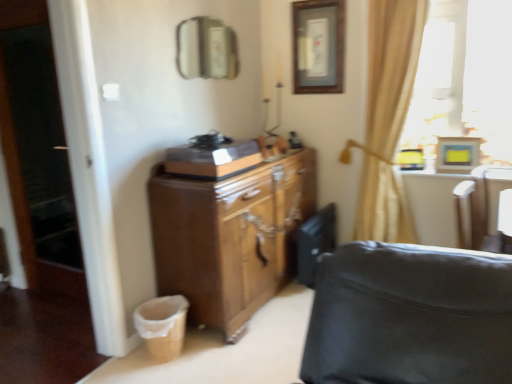
Locate an element on the screen. The width and height of the screenshot is (512, 384). beige fabric curtain at upper right is located at coordinates (388, 118).

What do you see at coordinates (40, 143) in the screenshot? I see `transparent glass screen door at left` at bounding box center [40, 143].

Locate an element on the screen. The image size is (512, 384). wooden picture frame at upper center, acting as the 1th picture frame starting from the left is located at coordinates (318, 46).

This screenshot has height=384, width=512. What do you see at coordinates (457, 154) in the screenshot? I see `wooden picture frame at upper right, which is counted as the second picture frame, starting from the left` at bounding box center [457, 154].

What is the approximate height of metallic rectangular mirror at upper center?

16.21 inches.

Locate an element on the screen. This screenshot has width=512, height=384. metallic rectangular mirror at upper center is located at coordinates (206, 49).

Image resolution: width=512 pixels, height=384 pixels. Identify the location of beige fabric curtain at upper right. (388, 118).

Is white leather swivel chair at right placed right next to beige fabric laundry basket at lower left?

No, white leather swivel chair at right is not next to beige fabric laundry basket at lower left.

Is white leather swivel chair at right further to the viewer compared to beige fabric laundry basket at lower left?

No, the depth of white leather swivel chair at right is less than that of beige fabric laundry basket at lower left.

Which is nearer, (x=472, y=181) or (x=175, y=336)?

Point (x=472, y=181) is farther from the camera than point (x=175, y=336).

From the image's perspective, which is above, wooden picture frame at upper right, the 1th picture frame when ordered from front to back, or wooden picture frame at upper center, marked as the 1th picture frame in a back-to-front arrangement?

wooden picture frame at upper center, marked as the 1th picture frame in a back-to-front arrangement, from the image's perspective.

Is wooden picture frame at upper right, which is counted as the second picture frame, starting from the left, positioned beyond the bounds of wooden picture frame at upper center, arranged as the 2th picture frame when viewed from the front?

Indeed, wooden picture frame at upper right, which is counted as the second picture frame, starting from the left, is completely outside wooden picture frame at upper center, arranged as the 2th picture frame when viewed from the front.

In the image, is wooden picture frame at upper right, the 2th picture frame in the top-to-bottom sequence, positioned in front of or behind wooden picture frame at upper center, acting as the second picture frame starting from the right?

Clearly, wooden picture frame at upper right, the 2th picture frame in the top-to-bottom sequence, is in front of wooden picture frame at upper center, acting as the second picture frame starting from the right.

Is wooden picture frame at upper right, the 1th picture frame when ordered from front to back, to the left of wooden picture frame at upper center, acting as the 1th picture frame starting from the left, from the viewer's perspective?

No, wooden picture frame at upper right, the 1th picture frame when ordered from front to back, is not to the left of wooden picture frame at upper center, acting as the 1th picture frame starting from the left.

Based on the photo, from the image's perspective, is wooden picture frame at upper right, the 1th picture frame from the bottom, positioned above or below wooden cabinet at center?

wooden picture frame at upper right, the 1th picture frame from the bottom, is situated higher than wooden cabinet at center in the image.

Who is taller, wooden picture frame at upper right, which is counted as the second picture frame, starting from the left, or wooden cabinet at center?

→ Standing taller between the two is wooden picture frame at upper right, which is counted as the second picture frame, starting from the left.

This screenshot has width=512, height=384. Identify the location of appliance that appears below the wooden picture frame at upper right, placed as the first picture frame when sorted from right to left (from the image's perspective). (213, 160).

Is wooden picture frame at upper right, placed as the first picture frame when sorted from right to left, outside of wooden cabinet at center?

wooden picture frame at upper right, placed as the first picture frame when sorted from right to left, lies outside wooden cabinet at center's area.

Is brown wood cabinet at center oriented towards beige fabric laundry basket at lower left?

No, brown wood cabinet at center does not turn towards beige fabric laundry basket at lower left.

Is brown wood cabinet at center in front of or behind beige fabric laundry basket at lower left in the image?

Clearly, brown wood cabinet at center is in front of beige fabric laundry basket at lower left.

Who is smaller, brown wood cabinet at center or beige fabric laundry basket at lower left?

beige fabric laundry basket at lower left.

From the image's perspective, is brown wood cabinet at center below beige fabric laundry basket at lower left?

No, from the image's perspective, brown wood cabinet at center is not beneath beige fabric laundry basket at lower left.

You are a GUI agent. You are given a task and a screenshot of the screen. Output one action in this format:
    pyautogui.click(x=<x>, y=<y>)
    Task: Click on the screen door located above the beige fabric laundry basket at lower left (from a real-world perspective)
    This screenshot has width=512, height=384.
    Given the screenshot: What is the action you would take?
    pyautogui.click(x=40, y=143)

From a real-world perspective, is transparent glass screen door at left below beige fabric laundry basket at lower left?

Actually, transparent glass screen door at left is physically above beige fabric laundry basket at lower left in the real world.

Considering the sizes of objects transparent glass screen door at left and beige fabric laundry basket at lower left in the image provided, who is taller, transparent glass screen door at left or beige fabric laundry basket at lower left?

transparent glass screen door at left is taller.

Is transparent glass screen door at left spatially inside beige fabric laundry basket at lower left, or outside of it?

transparent glass screen door at left is not inside beige fabric laundry basket at lower left, it's outside.

Is brown wood cabinet at center far away from white leather swivel chair at right?

Yes, brown wood cabinet at center is far from white leather swivel chair at right.

Does brown wood cabinet at center turn towards white leather swivel chair at right?

Yes, brown wood cabinet at center faces towards white leather swivel chair at right.

From a real-world perspective, which is physically above, brown wood cabinet at center or white leather swivel chair at right?

white leather swivel chair at right is physically above.

From the image's perspective, between wooden picture frame at upper right, placed as the first picture frame when sorted from right to left, and white leather swivel chair at right, which one is located above?

wooden picture frame at upper right, placed as the first picture frame when sorted from right to left, appears higher in the image.

Does wooden picture frame at upper right, the 2th picture frame in the top-to-bottom sequence, have a greater width compared to white leather swivel chair at right?

In fact, wooden picture frame at upper right, the 2th picture frame in the top-to-bottom sequence, might be narrower than white leather swivel chair at right.

Where is `picture frame that is the 1st one when counting upward from the white leather swivel chair at right (from the image's perspective)`? The width and height of the screenshot is (512, 384). picture frame that is the 1st one when counting upward from the white leather swivel chair at right (from the image's perspective) is located at coordinates (457, 154).

Would you say white leather swivel chair at right is part of wooden picture frame at upper right, placed as the first picture frame when sorted from right to left,'s contents?

That's incorrect, white leather swivel chair at right is not inside wooden picture frame at upper right, placed as the first picture frame when sorted from right to left.

You are a GUI agent. You are given a task and a screenshot of the screen. Output one action in this format:
    pyautogui.click(x=<x>, y=<y>)
    Task: Click on the swivel chair that is on the right side of beige fabric laundry basket at lower left
    Image resolution: width=512 pixels, height=384 pixels.
    Given the screenshot: What is the action you would take?
    pyautogui.click(x=474, y=206)

The height and width of the screenshot is (384, 512). Find the location of `picture frame above the wooden picture frame at upper right, the 1th picture frame from the bottom (from the image's perspective)`. picture frame above the wooden picture frame at upper right, the 1th picture frame from the bottom (from the image's perspective) is located at coordinates (318, 46).

Estimate the real-world distances between objects in this image. Which object is further from metallic rectangular mirror at upper center, wooden picture frame at upper center, acting as the second picture frame starting from the right, or white leather swivel chair at right?

white leather swivel chair at right is further to metallic rectangular mirror at upper center.

Which object lies nearer to the anchor point transparent glass screen door at left, beige fabric laundry basket at lower left or metallic rectangular mirror at upper center?

metallic rectangular mirror at upper center is positioned closer to the anchor transparent glass screen door at left.

Which object lies nearer to the anchor point beige fabric curtain at upper right, white leather swivel chair at right or brown wood cabinet at center?

The object closer to beige fabric curtain at upper right is white leather swivel chair at right.

Estimate the real-world distances between objects in this image. Which object is closer to beige fabric laundry basket at lower left, transparent glass screen door at left or metallic rectangular mirror at upper center?

transparent glass screen door at left lies closer to beige fabric laundry basket at lower left than the other object.

Looking at the image, which one is located closer to metallic rectangular mirror at upper center, wooden cabinet at center or beige fabric curtain at upper right?

Among the two, wooden cabinet at center is located nearer to metallic rectangular mirror at upper center.

Estimate the real-world distances between objects in this image. Which object is further from brown wood cabinet at center, wooden picture frame at upper center, marked as the 2th picture frame in a bottom-to-top arrangement, or transparent glass screen door at left?

Based on the image, transparent glass screen door at left appears to be further to brown wood cabinet at center.

Which object lies further to the anchor point wooden picture frame at upper center, marked as the 2th picture frame in a bottom-to-top arrangement, wooden cabinet at center or white leather swivel chair at right?

white leather swivel chair at right lies further to wooden picture frame at upper center, marked as the 2th picture frame in a bottom-to-top arrangement, than the other object.

Looking at the image, which one is located closer to beige fabric curtain at upper right, wooden picture frame at upper right, the 2th picture frame in the top-to-bottom sequence, or white leather swivel chair at right?

Based on the image, wooden picture frame at upper right, the 2th picture frame in the top-to-bottom sequence, appears to be nearer to beige fabric curtain at upper right.

Where is `cabinetry between transparent glass screen door at left and white leather swivel chair at right`? cabinetry between transparent glass screen door at left and white leather swivel chair at right is located at coordinates (230, 237).

Image resolution: width=512 pixels, height=384 pixels. I want to click on curtain between beige fabric laundry basket at lower left and wooden picture frame at upper right, which is counted as the second picture frame, starting from the left, in the horizontal direction, so click(388, 118).

Image resolution: width=512 pixels, height=384 pixels. In order to click on appliance between metallic rectangular mirror at upper center and brown wood cabinet at center from top to bottom in this screenshot , I will do `click(213, 160)`.

This screenshot has height=384, width=512. Find the location of `cabinetry between transparent glass screen door at left and beige fabric curtain at upper right in the horizontal direction`. cabinetry between transparent glass screen door at left and beige fabric curtain at upper right in the horizontal direction is located at coordinates (230, 237).